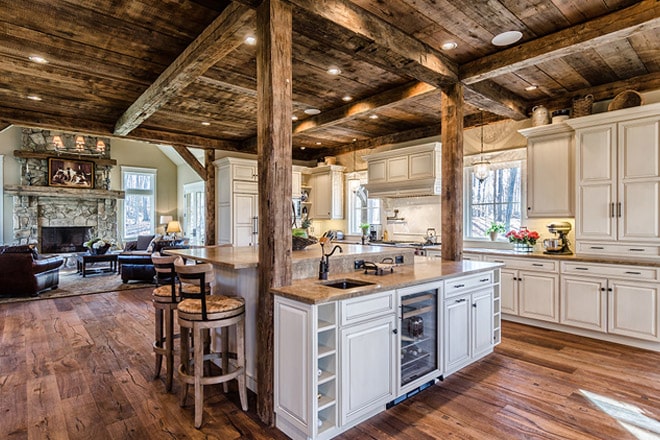
This screenshot has width=660, height=440. What are the coordinates of `windows` in the screenshot? It's located at (486, 219), (372, 213), (136, 212).